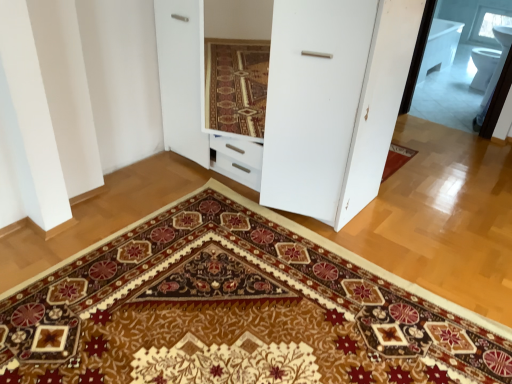
Question: Is carpeted mat at center oriented towards white glossy dresser at center?

Choices:
 (A) yes
 (B) no

Answer: (B)

Question: Considering the relative sizes of carpeted mat at center and white glossy dresser at center in the image provided, is carpeted mat at center shorter than white glossy dresser at center?

Choices:
 (A) yes
 (B) no

Answer: (A)

Question: Would you say carpeted mat at center is outside white glossy dresser at center?

Choices:
 (A) yes
 (B) no

Answer: (A)

Question: From a real-world perspective, is carpeted mat at center below white glossy dresser at center?

Choices:
 (A) yes
 (B) no

Answer: (A)

Question: Is carpeted mat at center wider than white glossy dresser at center?

Choices:
 (A) no
 (B) yes

Answer: (B)

Question: From their relative heights in the image, would you say transparent glass window at upper right is taller or shorter than carpeted mat at center?

Choices:
 (A) tall
 (B) short

Answer: (A)

Question: Would you say transparent glass window at upper right is to the left or to the right of carpeted mat at center in the picture?

Choices:
 (A) right
 (B) left

Answer: (A)

Question: From a real-world perspective, is transparent glass window at upper right above or below carpeted mat at center?

Choices:
 (A) below
 (B) above

Answer: (B)

Question: Relative to carpeted mat at center, is transparent glass window at upper right in front or behind?

Choices:
 (A) behind
 (B) front

Answer: (A)

Question: Which is correct: carpeted mat at center is inside transparent glass window at upper right, or outside of it?

Choices:
 (A) outside
 (B) inside

Answer: (A)

Question: Looking at their shapes, would you say carpeted mat at center is wider or thinner than transparent glass window at upper right?

Choices:
 (A) wide
 (B) thin

Answer: (A)

Question: Does point (445, 332) appear closer or farther from the camera than point (498, 11)?

Choices:
 (A) farther
 (B) closer

Answer: (B)

Question: From the image's perspective, relative to transparent glass window at upper right, is carpeted mat at center above or below?

Choices:
 (A) above
 (B) below

Answer: (B)

Question: Is transparent glass window at upper right to the left or to the right of white glossy dresser at center in the image?

Choices:
 (A) left
 (B) right

Answer: (B)

Question: From their relative heights in the image, would you say transparent glass window at upper right is taller or shorter than white glossy dresser at center?

Choices:
 (A) short
 (B) tall

Answer: (A)